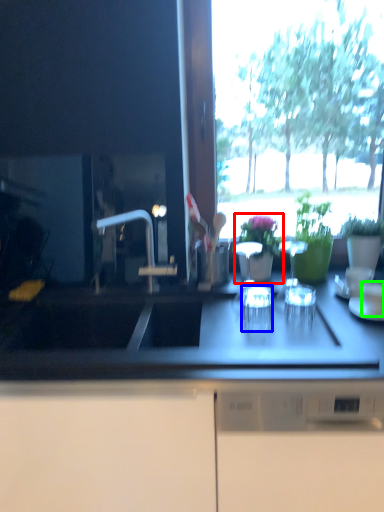
Question: Estimate the real-world distances between objects in this image. Which object is farther from houseplant (highlighted by a red box), tableware (highlighted by a blue box) or tableware (highlighted by a green box)?

Choices:
 (A) tableware
 (B) tableware

Answer: (B)